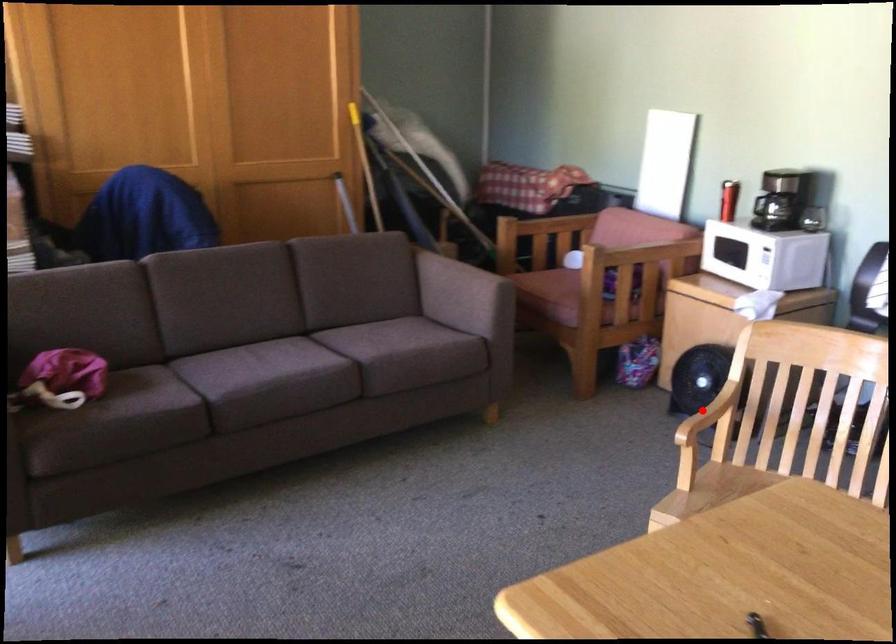
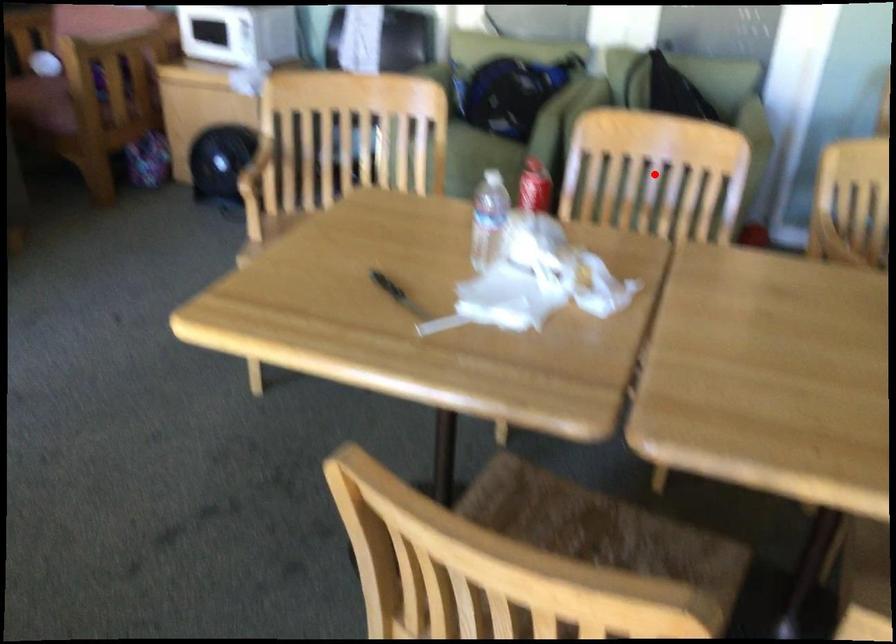
I am providing you with two images of the same scene from different viewpoints. A red point is marked on the first image and another point is marked on the second image. Is the red point in image1 aligned with the point shown in image2?

No